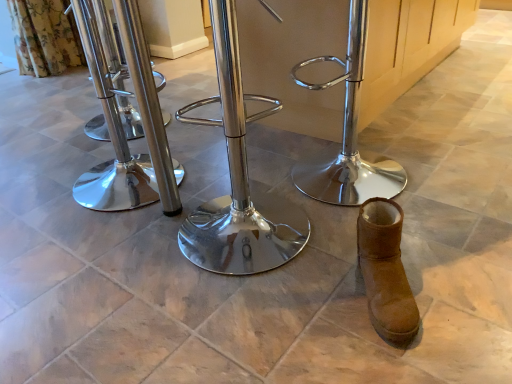
Question: Can you confirm if brown suede boot at lower right is bigger than polished metal swivel chair at center, which is the second swivel chair from right to left?

Choices:
 (A) no
 (B) yes

Answer: (A)

Question: From a real-world perspective, is brown suede boot at lower right beneath polished metal swivel chair at center, which is the second swivel chair from right to left?

Choices:
 (A) yes
 (B) no

Answer: (A)

Question: Is brown suede boot at lower right not inside polished metal swivel chair at center, which is the second swivel chair from right to left?

Choices:
 (A) yes
 (B) no

Answer: (A)

Question: Is brown suede boot at lower right oriented away from polished metal swivel chair at center, which is the second swivel chair from right to left?

Choices:
 (A) no
 (B) yes

Answer: (A)

Question: Is brown suede boot at lower right taller than polished metal swivel chair at center, which appears as the 2th swivel chair when viewed from the left?

Choices:
 (A) yes
 (B) no

Answer: (B)

Question: Considering their positions, is polished metal swivel chair at center, marked as the first swivel chair in a left-to-right arrangement, located in front of or behind polished metal swivel chair at center, which appears as the 2th swivel chair when viewed from the left?

Choices:
 (A) behind
 (B) front

Answer: (A)

Question: Is point (119, 201) closer or farther from the camera than point (245, 253)?

Choices:
 (A) closer
 (B) farther

Answer: (B)

Question: Is polished metal swivel chair at center, marked as the 3th swivel chair in a right-to-left arrangement, taller or shorter than polished metal swivel chair at center, which appears as the 2th swivel chair when viewed from the left?

Choices:
 (A) tall
 (B) short

Answer: (B)

Question: Is polished metal swivel chair at center, marked as the 3th swivel chair in a right-to-left arrangement, inside or outside of polished metal swivel chair at center, which is the second swivel chair from right to left?

Choices:
 (A) inside
 (B) outside

Answer: (B)

Question: Considering the positions of point [x=389, y=302] and point [x=135, y=76], is point [x=389, y=302] closer or farther from the camera than point [x=135, y=76]?

Choices:
 (A) closer
 (B) farther

Answer: (A)

Question: Considering the positions of brown suede boot at lower right and polished metal swivel chair at center, marked as the first swivel chair in a left-to-right arrangement, in the image, is brown suede boot at lower right wider or thinner than polished metal swivel chair at center, marked as the first swivel chair in a left-to-right arrangement,?

Choices:
 (A) wide
 (B) thin

Answer: (B)

Question: From the image's perspective, is brown suede boot at lower right positioned above or below polished metal swivel chair at center, marked as the 3th swivel chair in a right-to-left arrangement?

Choices:
 (A) below
 (B) above

Answer: (A)

Question: From their relative heights in the image, would you say brown suede boot at lower right is taller or shorter than polished metal swivel chair at center, marked as the 3th swivel chair in a right-to-left arrangement?

Choices:
 (A) tall
 (B) short

Answer: (B)

Question: Choose the correct answer: Is polished metal swivel chair at center, marked as the first swivel chair in a left-to-right arrangement, inside brown suede boot at lower right or outside it?

Choices:
 (A) outside
 (B) inside

Answer: (A)

Question: In the image, is polished metal swivel chair at center, marked as the 3th swivel chair in a right-to-left arrangement, on the left side or the right side of brown suede boot at lower right?

Choices:
 (A) left
 (B) right

Answer: (A)